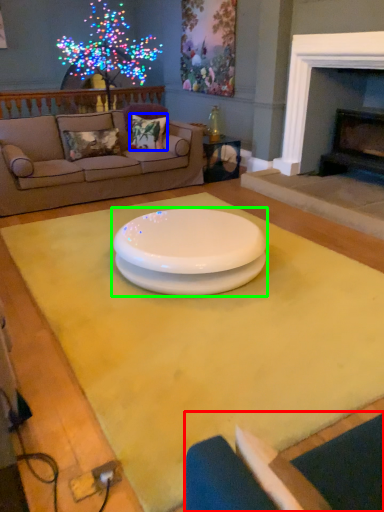
Question: Which object is positioned farthest from armchair (highlighted by a red box)? Select from pillow (highlighted by a blue box) and coffee table (highlighted by a green box).

Choices:
 (A) pillow
 (B) coffee table

Answer: (A)